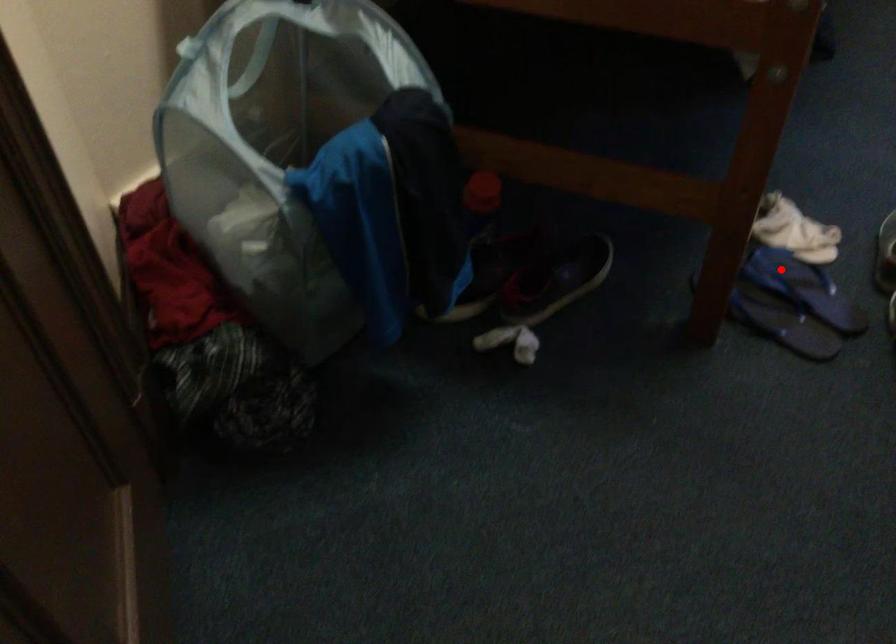
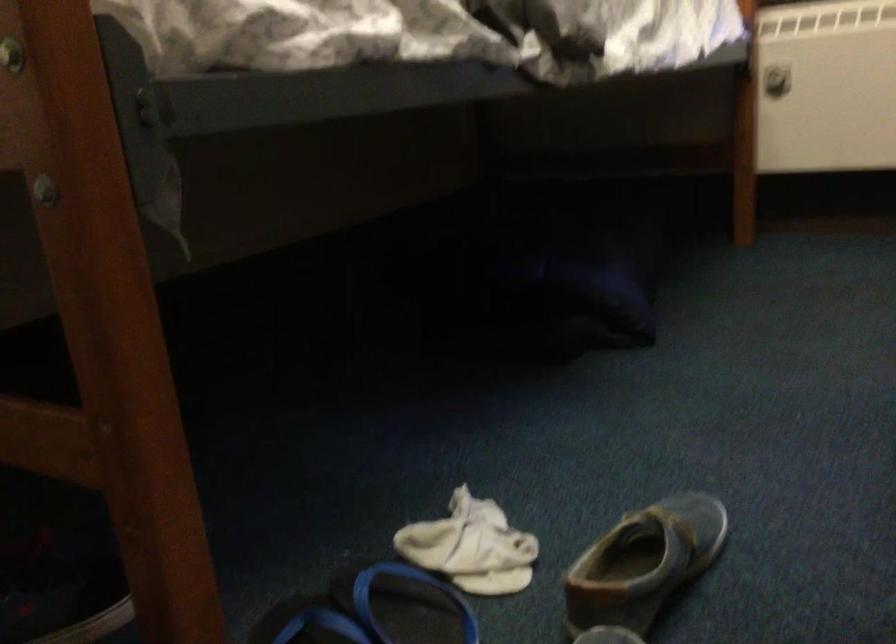
Question: I am providing you with two images of the same scene from different viewpoints. A red point is shown in image1. For the corresponding object point in image2, is it positioned nearer or farther from the camera?

Choices:
 (A) Nearer
 (B) Farther

Answer: (A)